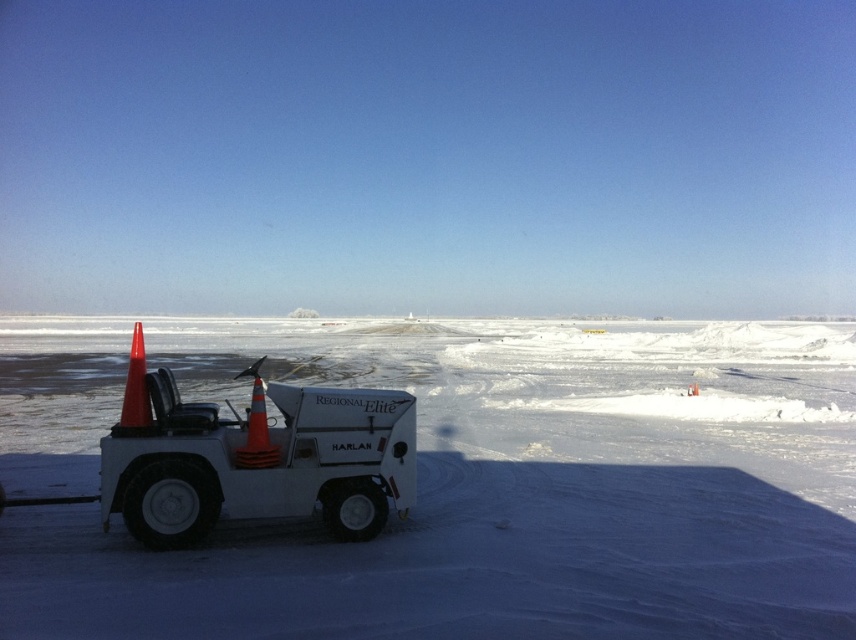
You are a snowplow operator who needs to clear the snow around the orange reflective cone at left and the white matte snowplow at center. Based on their positions, which object should you prioritize clearing first?

The white matte snowplow at center is in front of the orange reflective cone at left, so you should prioritize clearing the snow around the white matte snowplow at center first because it is closer to your current position.

You are a worker trying to locate the orange matte traffic cone at left. Based on the scene, where would you find it relative to the white matte snowplow at center?

The white matte snowplow at center is positioned under the orange matte traffic cone at left, so the orange matte traffic cone at left is above the white matte snowplow at center.

You are standing at the camera position and want to place a marker at the closest point between point (x=250, y=499) and point (x=257, y=451). Which point should you choose?

Point (x=250, y=499) is closer to the camera than point (x=257, y=451), so you should choose point (x=250, y=499).